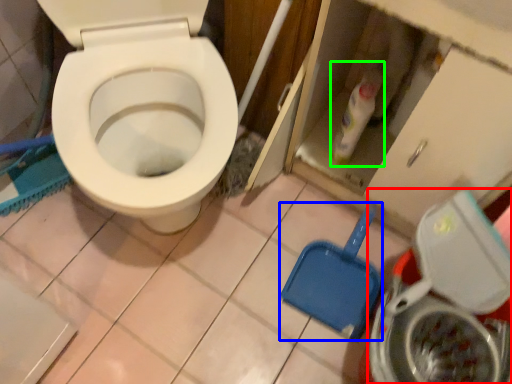
Question: Which object is positioned closest to washing machine (highlighted by a red box)? Select from shovel (highlighted by a blue box) and cleaning product (highlighted by a green box).

Choices:
 (A) shovel
 (B) cleaning product

Answer: (A)